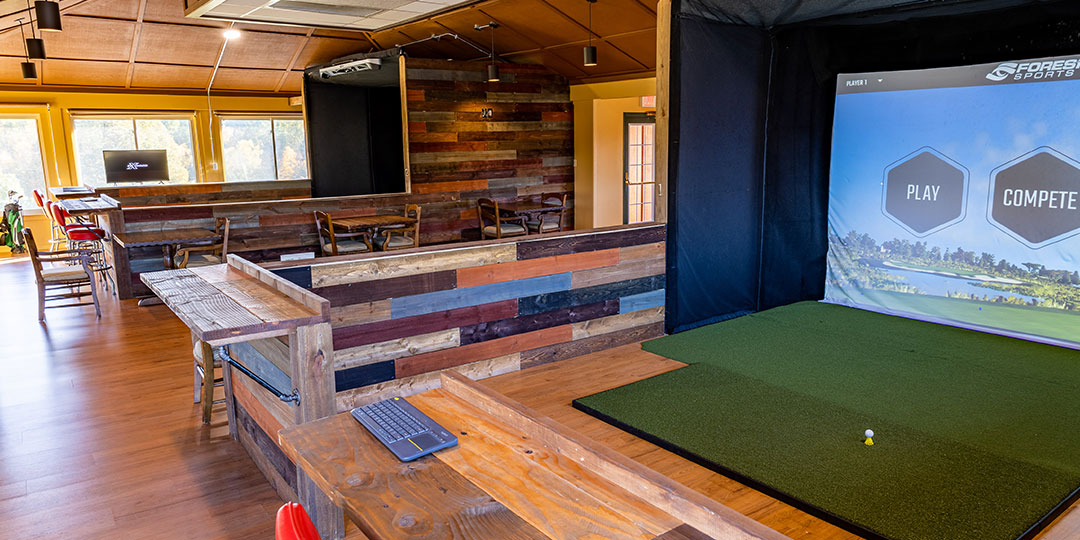
At what (x,y) coordinates should I click in order to perform the action: click on walls. Please return your answer as a coordinate pair (x, y). The height and width of the screenshot is (540, 1080). Looking at the image, I should click on 715,199, 437,140, 465,301, 253,409.